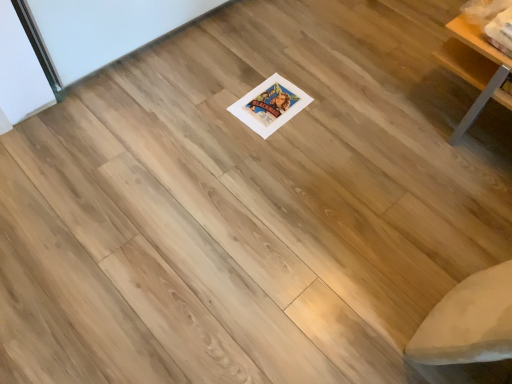
Find the location of `light brown wooden table at upper right`. light brown wooden table at upper right is located at coordinates (475, 69).

The width and height of the screenshot is (512, 384). Describe the element at coordinates (475, 69) in the screenshot. I see `light brown wooden table at upper right` at that location.

You are a GUI agent. You are given a task and a screenshot of the screen. Output one action in this format:
    pyautogui.click(x=<x>, y=<y>)
    Task: Click on the light brown wooden table at upper right
    Image resolution: width=512 pixels, height=384 pixels.
    Given the screenshot: What is the action you would take?
    [x=475, y=69]